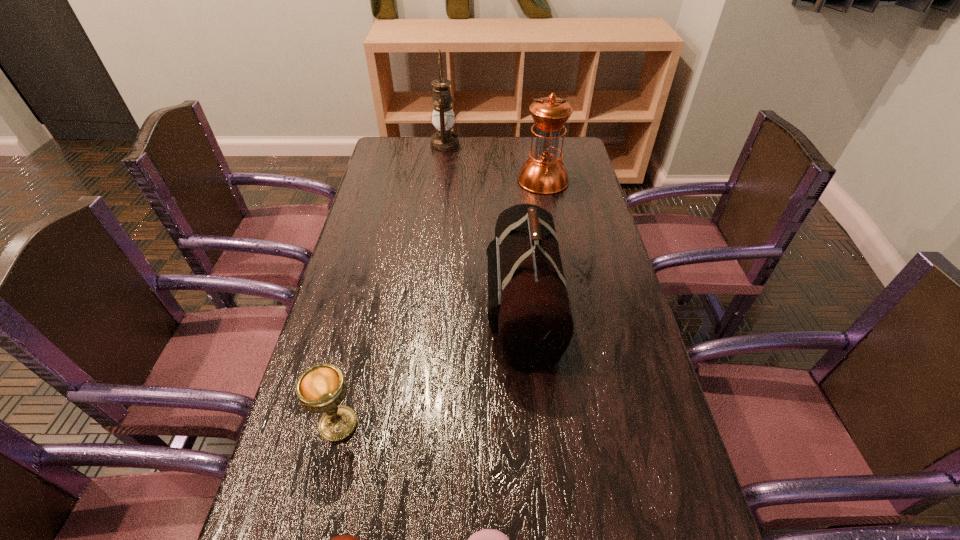
Image resolution: width=960 pixels, height=540 pixels. In the image, there is a desktop. In order to click on vacant space at the far right corner in this screenshot , I will do [x=561, y=137].

This screenshot has width=960, height=540. What are the coordinates of `free space between the right oil lamp and the fourth farthest object` in the screenshot? It's located at (441, 302).

This screenshot has width=960, height=540. Identify the location of vacant space that is in between the nearer oil lamp and the chalice. (441, 302).

At what (x,y) coordinates should I click in order to perform the action: click on vacant area that lies between the fourth tallest object and the second farthest object. Please return your answer as a coordinate pair (x, y). Looking at the image, I should click on (441, 302).

Select which object appears as the fourth closest to the farther oil lamp. Please provide its 2D coordinates. Your answer should be formatted as a tuple, i.e. [(x, y)], where the tuple contains the x and y coordinates of a point satisfying the conditions above.

[(487, 539)]

Find the location of a particular element. This screenshot has height=540, width=960. the closest object to the right oil lamp is located at coordinates (444, 140).

Locate an element on the screen. The image size is (960, 540). free location that satisfies the following two spatial constraints: 1. on the back side of the chalice; 2. on the right side of the farthest object is located at coordinates (405, 146).

Find the location of `vacant space that satisfies the following two spatial constraints: 1. on the front side of the farthest object; 2. on the left side of the fifth nearest object`. vacant space that satisfies the following two spatial constraints: 1. on the front side of the farthest object; 2. on the left side of the fifth nearest object is located at coordinates (442, 180).

Image resolution: width=960 pixels, height=540 pixels. Find the location of `vacant region that satisfies the following two spatial constraints: 1. on the back side of the fourth farthest object; 2. on the left side of the farther oil lamp`. vacant region that satisfies the following two spatial constraints: 1. on the back side of the fourth farthest object; 2. on the left side of the farther oil lamp is located at coordinates (405, 146).